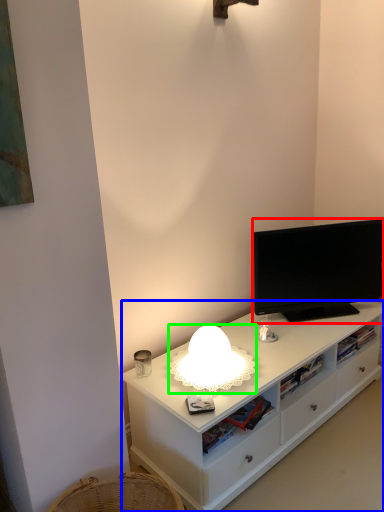
Question: Which is farther away from television (highlighted by a red box)? cabinetry (highlighted by a blue box) or lamp (highlighted by a green box)?

Choices:
 (A) cabinetry
 (B) lamp

Answer: (B)